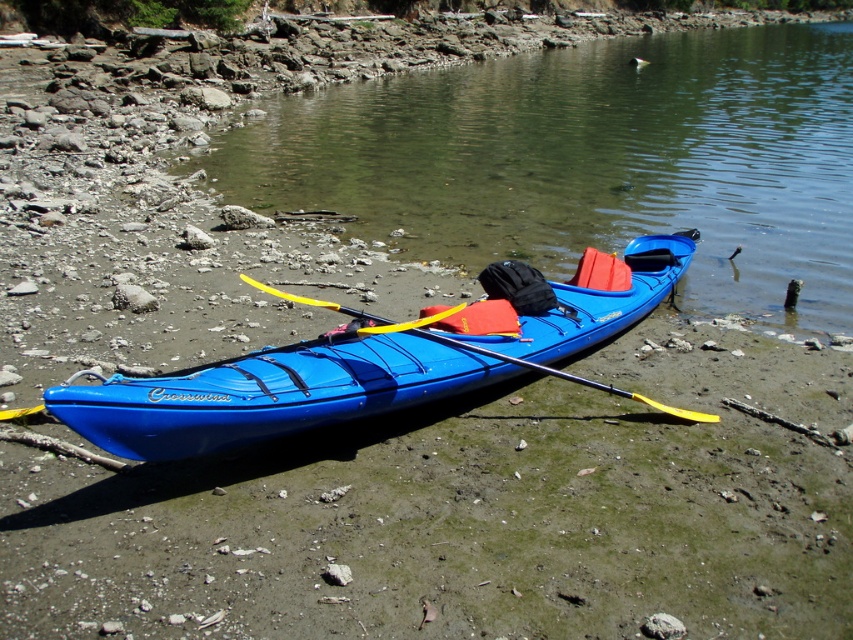
Is blue plastic kayak at center above yellow plastic paddle at center?

Yes, blue plastic kayak at center is above yellow plastic paddle at center.

Where is `blue plastic kayak at center`? blue plastic kayak at center is located at coordinates (352, 371).

Can you confirm if clear water at lower center is bigger than yellow plastic paddle at center?

Yes.

Which is in front, point (544, 198) or point (668, 412)?

Positioned in front is point (668, 412).

Locate an element on the screen. The height and width of the screenshot is (640, 853). clear water at lower center is located at coordinates (590, 161).

In order to click on clear water at lower center in this screenshot , I will do `click(590, 161)`.

Is clear water at lower center closer to camera compared to blue plastic kayak at center?

That is False.

Does clear water at lower center appear on the right side of blue plastic kayak at center?

Indeed, clear water at lower center is positioned on the right side of blue plastic kayak at center.

Image resolution: width=853 pixels, height=640 pixels. I want to click on clear water at lower center, so click(x=590, y=161).